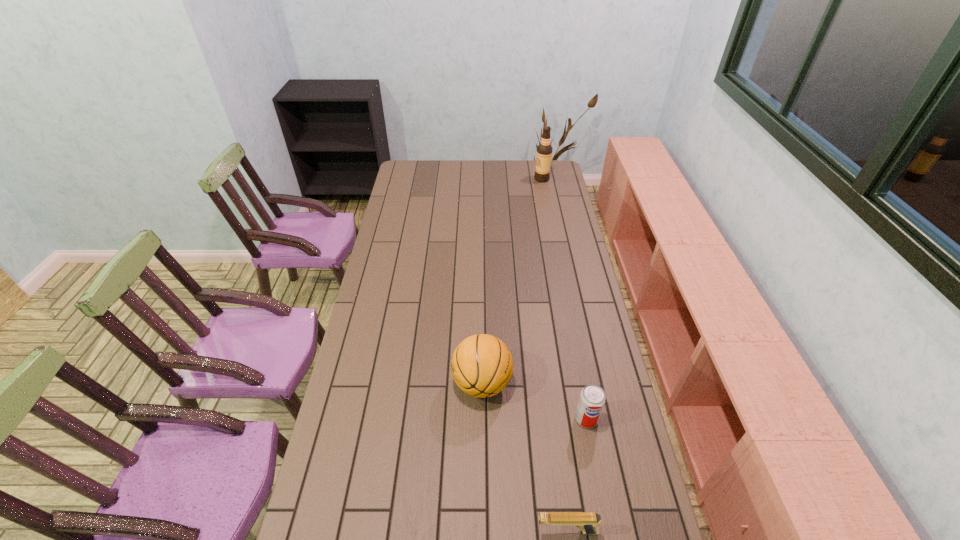
Image resolution: width=960 pixels, height=540 pixels. I want to click on vacant area in the image that satisfies the following two spatial constraints: 1. on the front side of the third tallest object; 2. at the barrel of the shortest object, so click(609, 531).